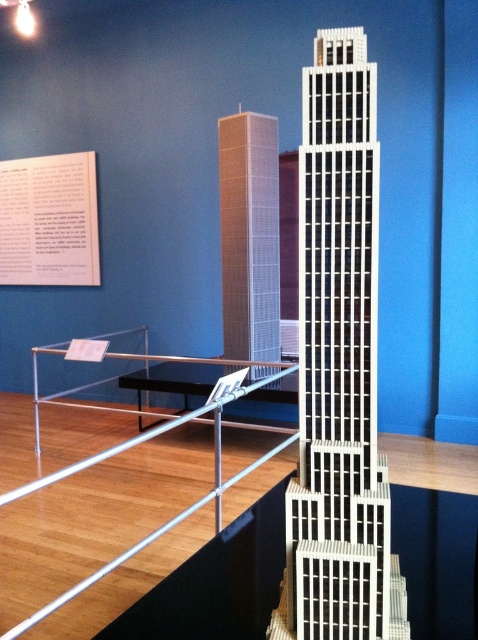
You are standing in front of the model display. Where exactly is the white textured building at center located in terms of coordinates?

The white textured building at center is located at coordinates point [338,365].